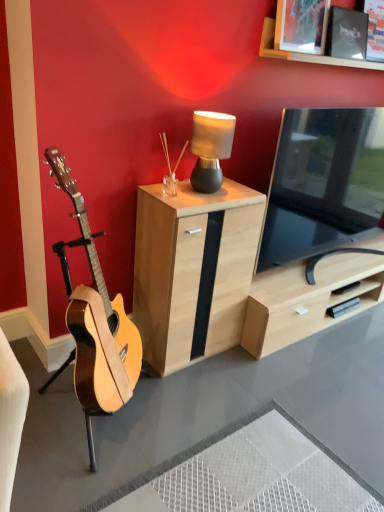
Locate an element on the screen. This screenshot has width=384, height=512. matte black picture frame at upper right, the second picture frame when ordered from left to right is located at coordinates (346, 34).

Locate an element on the screen. natural wood guitar at left is located at coordinates (97, 321).

At what (x,y) coordinates should I click in order to perform the action: click on matte black lamp at center. Please return your answer as a coordinate pair (x, y). The width and height of the screenshot is (384, 512). Looking at the image, I should click on (210, 148).

The image size is (384, 512). Describe the element at coordinates (323, 182) in the screenshot. I see `black glossy tv at right` at that location.

Where is `wooden picture frame at upper right, which ranks as the first picture frame in left-to-right order`? The image size is (384, 512). wooden picture frame at upper right, which ranks as the first picture frame in left-to-right order is located at coordinates (301, 25).

Identify the location of matte black picture frame at upper right, which appears as the first picture frame when viewed from the right. The image size is (384, 512). (346, 34).

Considering the positions of objects matte black picture frame at upper right, which appears as the first picture frame when viewed from the right, and black glossy tv at right in the image provided, who is more to the right, matte black picture frame at upper right, which appears as the first picture frame when viewed from the right, or black glossy tv at right?

Positioned to the right is black glossy tv at right.

From the image's perspective, which one is positioned higher, matte black picture frame at upper right, the second picture frame when ordered from left to right, or black glossy tv at right?

matte black picture frame at upper right, the second picture frame when ordered from left to right, appears higher in the image.

Considering the sizes of objects matte black picture frame at upper right, which appears as the first picture frame when viewed from the right, and black glossy tv at right in the image provided, who is smaller, matte black picture frame at upper right, which appears as the first picture frame when viewed from the right, or black glossy tv at right?

matte black picture frame at upper right, which appears as the first picture frame when viewed from the right, is smaller.

Is black glossy tv at right bigger or smaller than wooden picture frame at upper right, which ranks as the first picture frame in left-to-right order?

In the image, black glossy tv at right appears to be larger than wooden picture frame at upper right, which ranks as the first picture frame in left-to-right order.

Can you tell me how much black glossy tv at right and wooden picture frame at upper right, which ranks as the first picture frame in left-to-right order, differ in facing direction?

0.372 degrees.

Where is `the 2nd picture frame counting from the left side of the black glossy tv at right`? the 2nd picture frame counting from the left side of the black glossy tv at right is located at coordinates (301, 25).

Is black glossy tv at right turned away from wooden picture frame at upper right, which ranks as the first picture frame in left-to-right order?

No, black glossy tv at right's orientation is not away from wooden picture frame at upper right, which ranks as the first picture frame in left-to-right order.

I want to click on cabinetry that is on the left side of matte black lamp at center, so click(193, 270).

In the scene shown: Considering the sizes of objects matte black lamp at center and light wood cabinet at center in the image provided, who is taller, matte black lamp at center or light wood cabinet at center?

light wood cabinet at center is taller.

In terms of width, does matte black lamp at center look wider or thinner when compared to light wood cabinet at center?

Considering their sizes, matte black lamp at center looks slimmer than light wood cabinet at center.

Can black glossy tv at right be found inside natural wood guitar at left?

No, black glossy tv at right is not a part of natural wood guitar at left.

Which object is positioned more to the right, natural wood guitar at left or black glossy tv at right?

black glossy tv at right.

Is point (126, 381) positioned behind point (302, 202)?

No, it is in front of (302, 202).

Is black glossy tv at right at the back of natural wood guitar at left?

No, black glossy tv at right is not at the back of natural wood guitar at left.

Can matte black picture frame at upper right, the second picture frame when ordered from left to right, be found inside natural wood guitar at left?

Actually, matte black picture frame at upper right, the second picture frame when ordered from left to right, is outside natural wood guitar at left.

Is natural wood guitar at left oriented towards matte black picture frame at upper right, which appears as the first picture frame when viewed from the right?

No, natural wood guitar at left is not aimed at matte black picture frame at upper right, which appears as the first picture frame when viewed from the right.

Is natural wood guitar at left smaller than matte black picture frame at upper right, which appears as the first picture frame when viewed from the right?

No.

Is point (92, 391) positioned after point (327, 35)?

No, (92, 391) is closer to viewer.

From their relative heights in the image, would you say light wood cabinet at center is taller or shorter than natural wood guitar at left?

In the image, light wood cabinet at center appears to be shorter than natural wood guitar at left.

Between light wood cabinet at center and natural wood guitar at left, which one appears on the right side from the viewer's perspective?

light wood cabinet at center.

Is light wood cabinet at center completely or partially outside of natural wood guitar at left?

Yes, light wood cabinet at center is not within natural wood guitar at left.

From a real-world perspective, is light wood cabinet at center beneath natural wood guitar at left?

Yes, from a real-world perspective, light wood cabinet at center is under natural wood guitar at left.

Is the depth of wooden picture frame at upper right, the 2th picture frame positioned from the right, greater than that of matte black picture frame at upper right, the second picture frame when ordered from left to right?

No, the depth of wooden picture frame at upper right, the 2th picture frame positioned from the right, is less than that of matte black picture frame at upper right, the second picture frame when ordered from left to right.

Locate an element on the screen. picture frame located below the matte black picture frame at upper right, the second picture frame when ordered from left to right (from the image's perspective) is located at coordinates click(x=301, y=25).

Is matte black picture frame at upper right, the second picture frame when ordered from left to right, at the back of wooden picture frame at upper right, which ranks as the first picture frame in left-to-right order?

wooden picture frame at upper right, which ranks as the first picture frame in left-to-right order, does not have its back to matte black picture frame at upper right, the second picture frame when ordered from left to right.

Is wooden picture frame at upper right, the 2th picture frame positioned from the right, bigger than matte black picture frame at upper right, the second picture frame when ordered from left to right?

Yes, wooden picture frame at upper right, the 2th picture frame positioned from the right, is bigger than matte black picture frame at upper right, the second picture frame when ordered from left to right.

You are a GUI agent. You are given a task and a screenshot of the screen. Output one action in this format:
    pyautogui.click(x=<x>, y=<y>)
    Task: Click on the television that is on the right side of matte black picture frame at upper right, the second picture frame when ordered from left to right
    The image size is (384, 512).
    Given the screenshot: What is the action you would take?
    pyautogui.click(x=323, y=182)

The width and height of the screenshot is (384, 512). In order to click on the 2nd picture frame counting from the left side of the black glossy tv at right in this screenshot , I will do `click(301, 25)`.

Based on their spatial positions, is wooden picture frame at upper right, the 2th picture frame positioned from the right, or natural wood guitar at left further from matte black lamp at center?

Among the two, natural wood guitar at left is located further to matte black lamp at center.

From the image, which object appears to be farther from light wood cabinet at center, wooden picture frame at upper right, which ranks as the first picture frame in left-to-right order, or black glossy tv at right?

wooden picture frame at upper right, which ranks as the first picture frame in left-to-right order, lies further to light wood cabinet at center than the other object.

Looking at the image, which one is located closer to natural wood guitar at left, matte black lamp at center or black glossy tv at right?

matte black lamp at center is closer to natural wood guitar at left.

From the image, which object appears to be farther from wooden picture frame at upper right, which ranks as the first picture frame in left-to-right order, light wood cabinet at center or natural wood guitar at left?

natural wood guitar at left lies further to wooden picture frame at upper right, which ranks as the first picture frame in left-to-right order, than the other object.

Looking at the image, which one is located further to light wood cabinet at center, matte black picture frame at upper right, which appears as the first picture frame when viewed from the right, or matte black lamp at center?

Based on the image, matte black picture frame at upper right, which appears as the first picture frame when viewed from the right, appears to be further to light wood cabinet at center.

When comparing their distances from light wood cabinet at center, does matte black picture frame at upper right, which appears as the first picture frame when viewed from the right, or wooden picture frame at upper right, which ranks as the first picture frame in left-to-right order, seem further?

matte black picture frame at upper right, which appears as the first picture frame when viewed from the right, lies further to light wood cabinet at center than the other object.

Based on their spatial positions, is light wood cabinet at center or natural wood guitar at left further from black glossy tv at right?

Among the two, natural wood guitar at left is located further to black glossy tv at right.

Considering their positions, is matte black picture frame at upper right, the second picture frame when ordered from left to right, positioned closer to natural wood guitar at left than matte black lamp at center?

Based on the image, matte black lamp at center appears to be nearer to natural wood guitar at left.

This screenshot has height=512, width=384. I want to click on picture frame between matte black picture frame at upper right, the second picture frame when ordered from left to right, and matte black lamp at center from top to bottom, so click(x=301, y=25).

You are a GUI agent. You are given a task and a screenshot of the screen. Output one action in this format:
    pyautogui.click(x=<x>, y=<y>)
    Task: Click on the lamp between wooden picture frame at upper right, which ranks as the first picture frame in left-to-right order, and natural wood guitar at left vertically
    
    Given the screenshot: What is the action you would take?
    [x=210, y=148]

Identify the location of picture frame between matte black picture frame at upper right, which appears as the first picture frame when viewed from the right, and black glossy tv at right vertically. The height and width of the screenshot is (512, 384). (301, 25).

Find the location of a particular element. This screenshot has width=384, height=512. lamp between matte black picture frame at upper right, which appears as the first picture frame when viewed from the right, and natural wood guitar at left vertically is located at coordinates (210, 148).